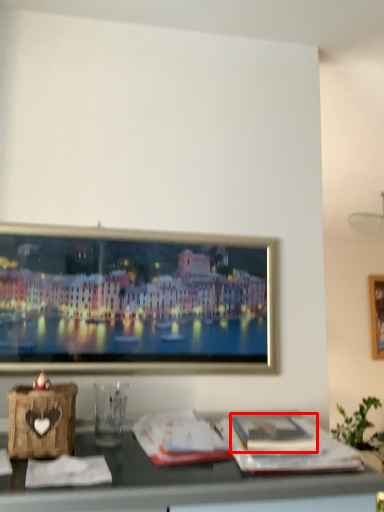
Question: From the image's perspective, where is magazine (annotated by the red box) located relative to magazine?

Choices:
 (A) above
 (B) below

Answer: (A)